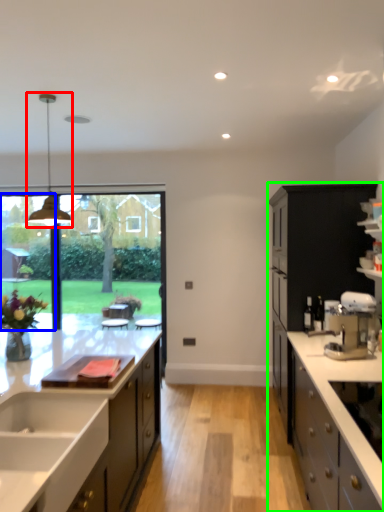
Question: Based on their relative distances, which object is nearer to light fixture (highlighted by a red box)? Choose from window screen (highlighted by a blue box) and cabinetry (highlighted by a green box).

Choices:
 (A) window screen
 (B) cabinetry

Answer: (A)